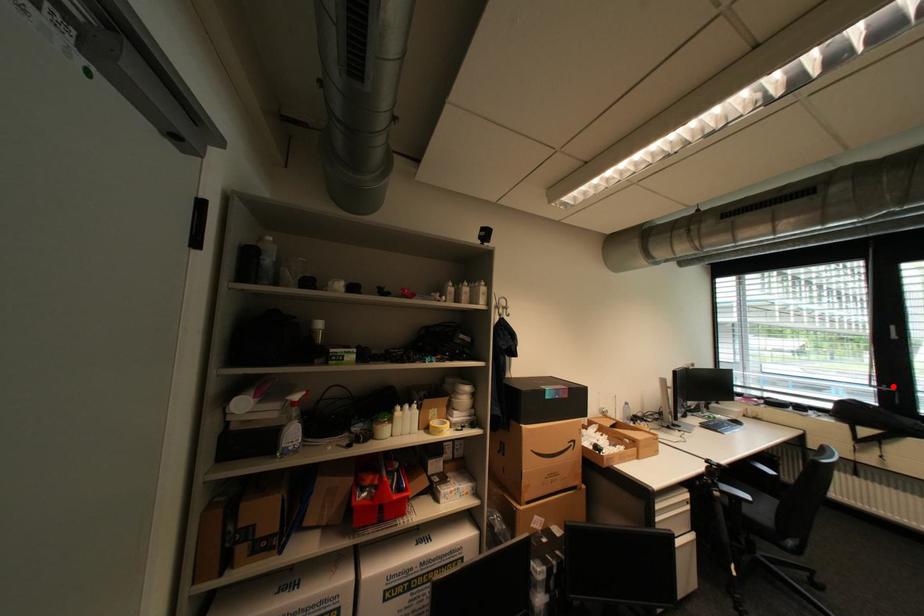
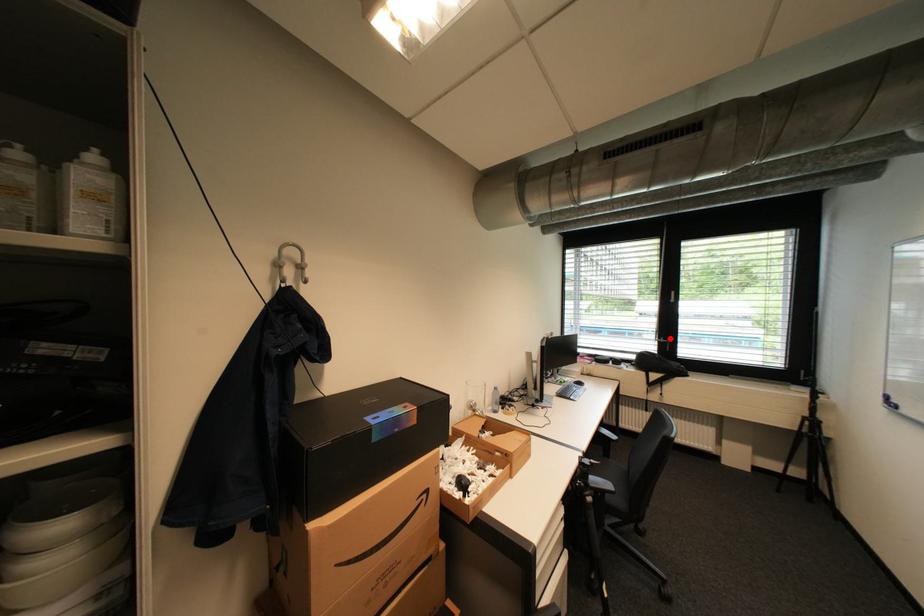
I am providing you with two images of the same scene from different viewpoints. A red point is marked on the first image and another point is marked on the second image. Is the marked point in image1 the same physical position as the marked point in image2?

Yes